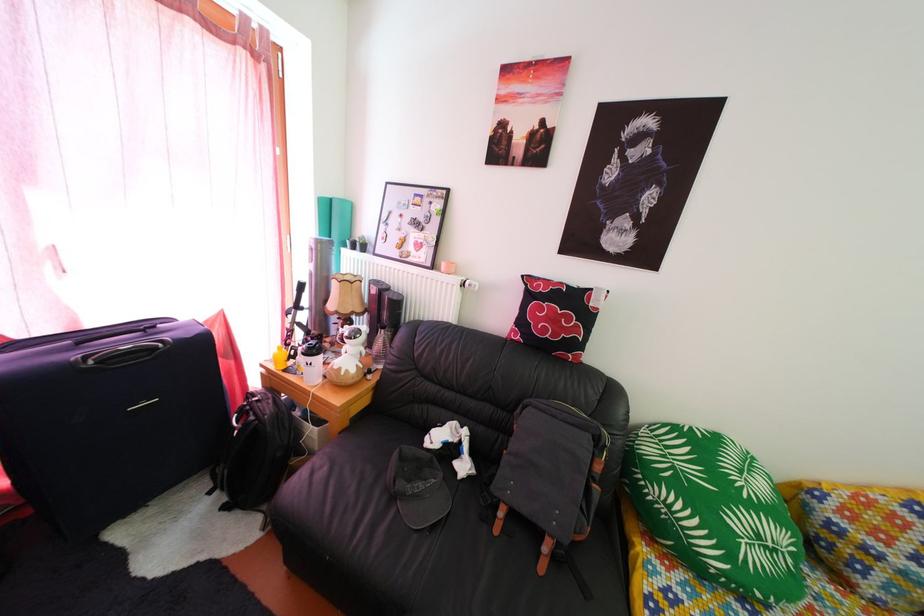
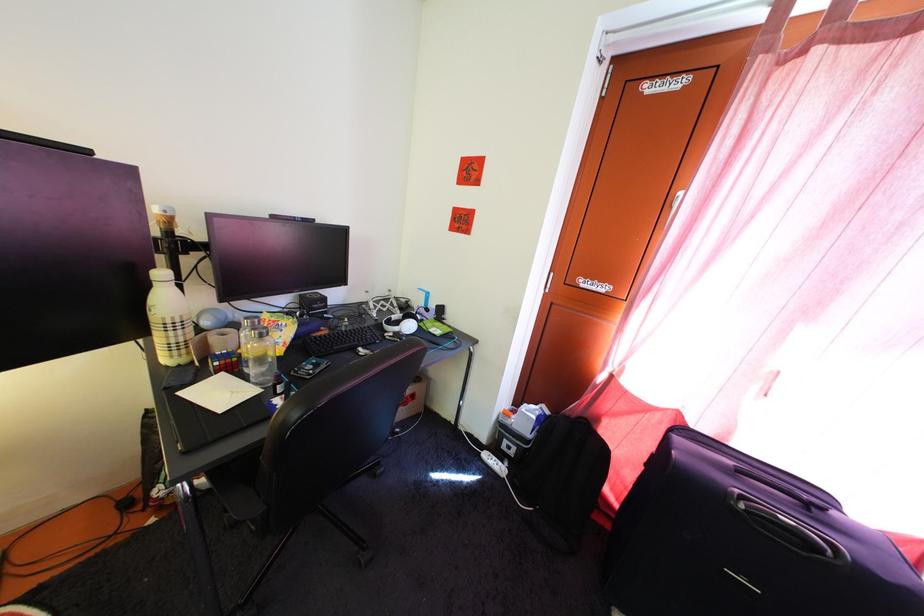
Locate, in the second image, the point that corresponds to (101,371) in the first image.

(751, 515)